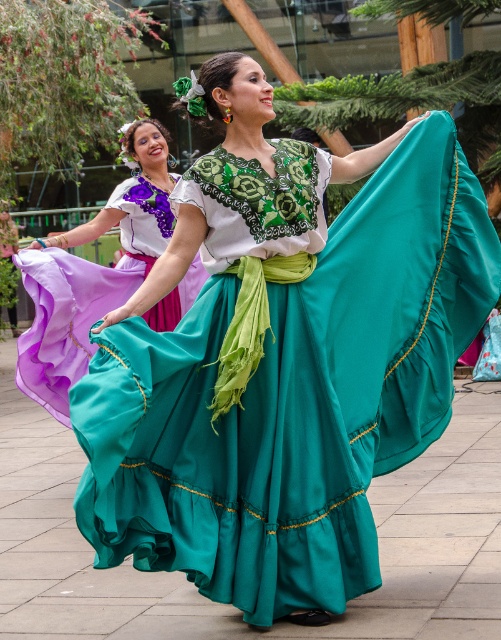
Question: Which point is farther from the camera taking this photo?

Choices:
 (A) tap(125, 243)
 (B) tap(169, 467)

Answer: (A)

Question: Is teal satin dress at center smaller than matte purple skirt at left?

Choices:
 (A) yes
 (B) no

Answer: (B)

Question: Which object appears closest to the camera in this image?

Choices:
 (A) teal satin dress at center
 (B) matte purple skirt at left

Answer: (A)

Question: Which object appears farthest from the camera in this image?

Choices:
 (A) teal satin dress at center
 (B) matte purple skirt at left

Answer: (B)

Question: Can you confirm if teal satin dress at center is smaller than matte purple skirt at left?

Choices:
 (A) yes
 (B) no

Answer: (B)

Question: Is teal satin dress at center positioned before matte purple skirt at left?

Choices:
 (A) no
 (B) yes

Answer: (B)